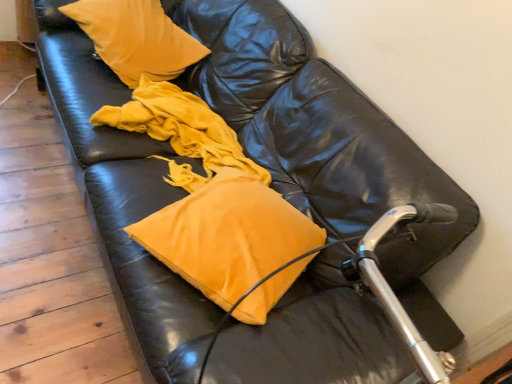
Question: Is matte yellow pillow at center, positioned as the second pillow in back-to-front order, closer to the viewer compared to velvet yellow pillow at upper left, placed as the 2th pillow when sorted from bottom to top?

Choices:
 (A) no
 (B) yes

Answer: (B)

Question: From the image's perspective, is matte yellow pillow at center, acting as the first pillow starting from the front, beneath velvet yellow pillow at upper left, placed as the 2th pillow when sorted from bottom to top?

Choices:
 (A) yes
 (B) no

Answer: (A)

Question: Can you confirm if matte yellow pillow at center, the 1th pillow positioned from the bottom, is positioned to the left of velvet yellow pillow at upper left, placed as the 2th pillow when sorted from bottom to top?

Choices:
 (A) yes
 (B) no

Answer: (B)

Question: Considering the relative sizes of matte yellow pillow at center, marked as the second pillow in a top-to-bottom arrangement, and velvet yellow pillow at upper left, the 1th pillow in the back-to-front sequence, in the image provided, is matte yellow pillow at center, marked as the second pillow in a top-to-bottom arrangement, bigger than velvet yellow pillow at upper left, the 1th pillow in the back-to-front sequence,?

Choices:
 (A) yes
 (B) no

Answer: (B)

Question: Considering the relative sizes of matte yellow pillow at center, positioned as the second pillow in back-to-front order, and velvet yellow pillow at upper left, marked as the 2th pillow in a front-to-back arrangement, in the image provided, is matte yellow pillow at center, positioned as the second pillow in back-to-front order, smaller than velvet yellow pillow at upper left, marked as the 2th pillow in a front-to-back arrangement,?

Choices:
 (A) no
 (B) yes

Answer: (B)

Question: Visually, is matte yellow pillow at center, the 1th pillow positioned from the bottom, positioned to the left or to the right of velvet yellow pillow at upper left, which ranks as the 1th pillow in top-to-bottom order?

Choices:
 (A) left
 (B) right

Answer: (B)

Question: Is matte yellow pillow at center, the 1th pillow positioned from the bottom, bigger or smaller than velvet yellow pillow at upper left, the 1th pillow in the back-to-front sequence?

Choices:
 (A) small
 (B) big

Answer: (A)

Question: From their relative heights in the image, would you say matte yellow pillow at center, acting as the first pillow starting from the front, is taller or shorter than velvet yellow pillow at upper left, placed as the 2th pillow when sorted from bottom to top?

Choices:
 (A) short
 (B) tall

Answer: (A)

Question: From a real-world perspective, is matte yellow pillow at center, marked as the second pillow in a top-to-bottom arrangement, physically located above or below velvet yellow pillow at upper left, placed as the 2th pillow when sorted from bottom to top?

Choices:
 (A) above
 (B) below

Answer: (B)

Question: Considering the positions of matte yellow pillow at center, positioned as the second pillow in back-to-front order, and matte yellow pillow at center in the image, is matte yellow pillow at center, positioned as the second pillow in back-to-front order, taller or shorter than matte yellow pillow at center?

Choices:
 (A) short
 (B) tall

Answer: (A)

Question: Is matte yellow pillow at center, positioned as the second pillow in back-to-front order, inside the boundaries of matte yellow pillow at center, or outside?

Choices:
 (A) inside
 (B) outside

Answer: (B)

Question: Would you say matte yellow pillow at center, acting as the first pillow starting from the front, is to the left or to the right of matte yellow pillow at center in the picture?

Choices:
 (A) right
 (B) left

Answer: (A)

Question: Considering the positions of point (238, 205) and point (221, 140), is point (238, 205) closer or farther from the camera than point (221, 140)?

Choices:
 (A) closer
 (B) farther

Answer: (A)

Question: From a real-world perspective, is velvet yellow pillow at upper left, placed as the 2th pillow when sorted from bottom to top, above or below matte yellow pillow at center, acting as the first pillow starting from the front?

Choices:
 (A) below
 (B) above

Answer: (B)

Question: Considering the positions of point (169, 24) and point (249, 271), is point (169, 24) closer or farther from the camera than point (249, 271)?

Choices:
 (A) closer
 (B) farther

Answer: (B)